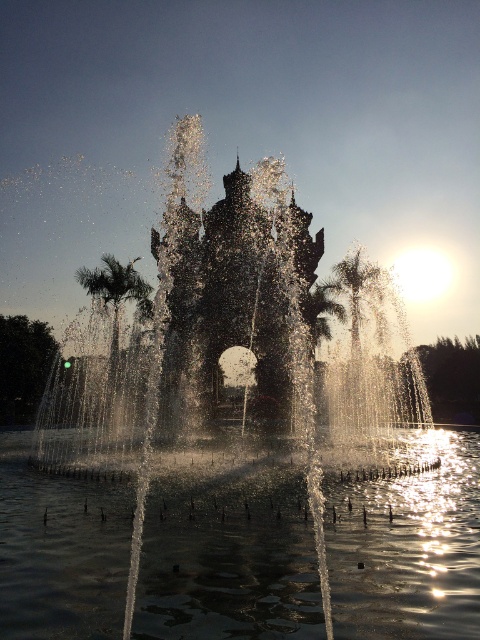
You are standing at the edge of the fountain and want to take a photo of the green leafy palm tree at left without the clear liquid water at center blocking the view. Is the palm tree visible to your left side?

The clear liquid water at center is to the right of the green leafy palm tree at left, so yes, the green leafy palm tree at left is visible to your left side without obstruction from the water.

You are a photographer trying to capture the sunset at the fountain. You need to know which object in the scene is wider to frame your shot properly. Which is wider, the clear liquid water at center or the green leafy palm tree at left?

The clear liquid water at center is wider than the green leafy palm tree at left according to the description.